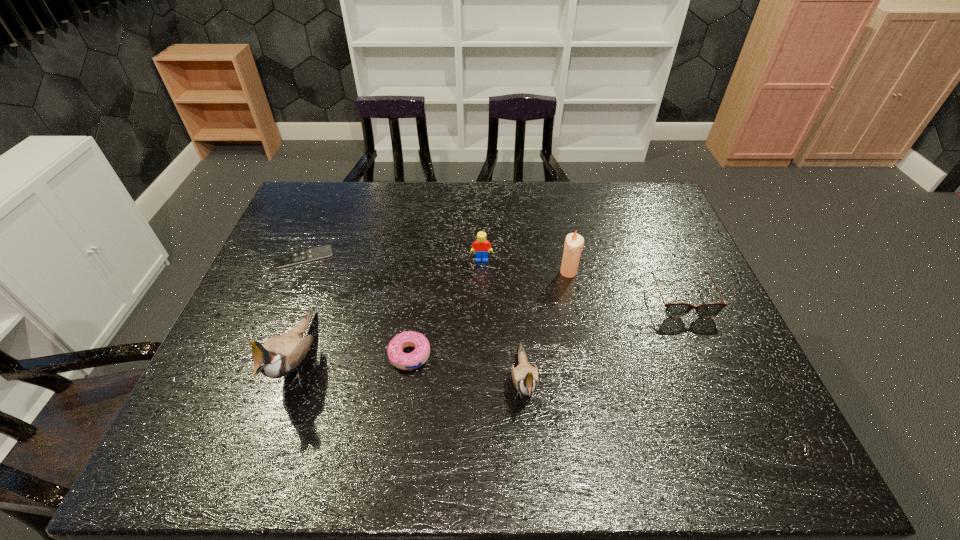
Observe the arrangement of all birds in the image. To keep them evenly spaced, where would you place another bird on the right? Please locate a free space. Please provide its 2D coordinates. Your answer should be formatted as a tuple, i.e. [(x, y)], where the tuple contains the x and y coordinates of a point satisfying the conditions above.

[(767, 403)]